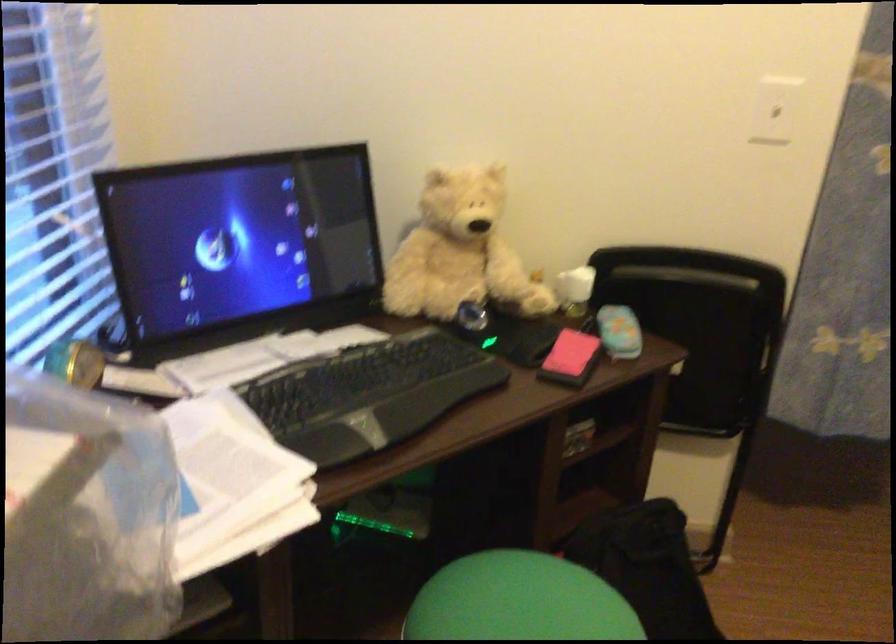
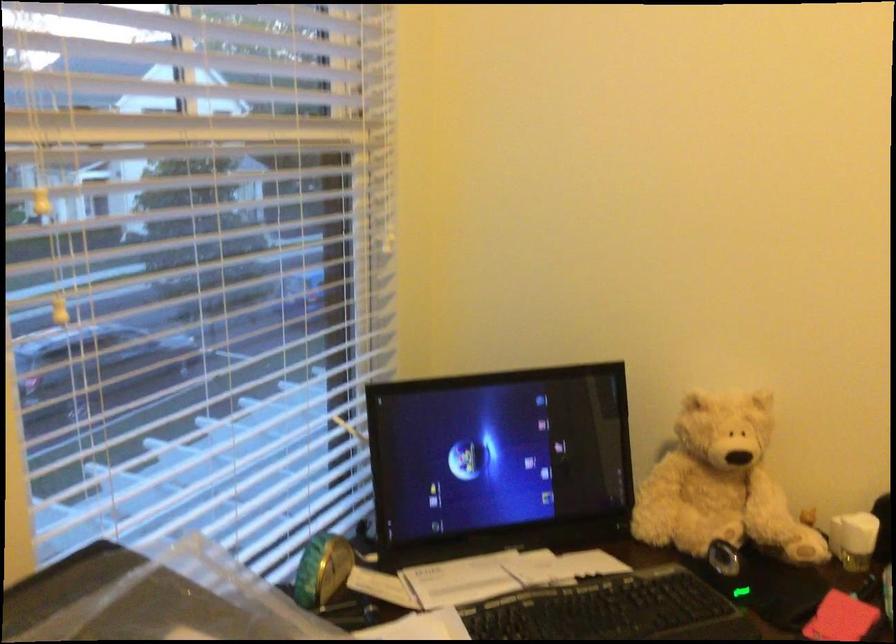
Locate, in the second image, the point that corresponds to point 72,368 in the first image.

(322, 569)